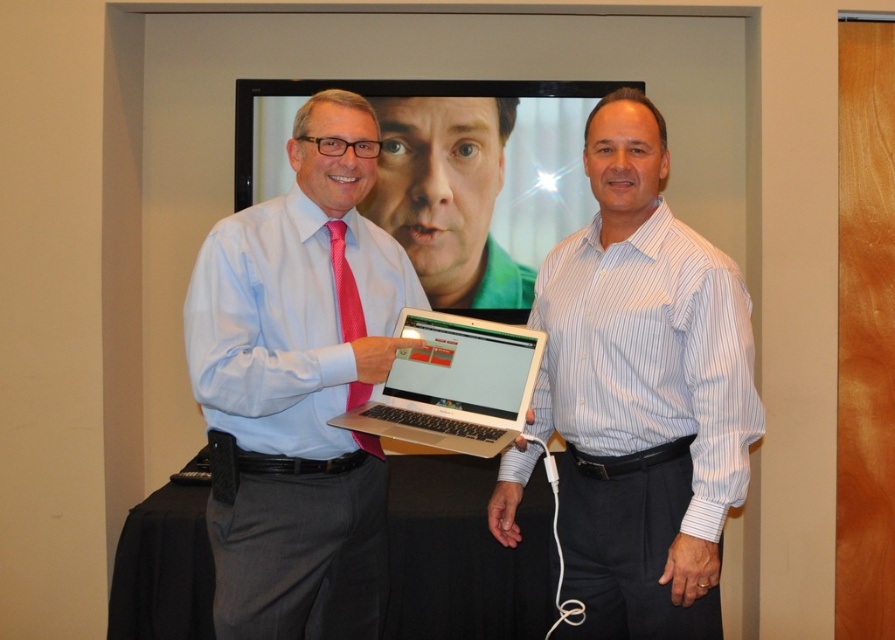
You are a photographer taking a picture of two men. You notice both the matte pink tie at center and the pink satin tie at center. Which tie will be more visible in the photo?

The matte pink tie at center is in front of the pink satin tie at center, so it will be more visible in the photo.

You are a photographer taking a picture of the scene. The camera is positioned to capture the man on the left and the man on the right. Where is the white striped shirt at center located in relation to the point marked at coordinates (644, 392)?

The point at coordinates (644, 392) indicates the location of the white striped shirt at center.

You are organizing a formal event and need to choose between the matte pink tie at center and the pink satin tie at center based on their widths. Which tie should you select if you prefer a wider option?

The matte pink tie at center is wider than the pink satin tie at center, so you should select the matte pink tie at center for a wider option.